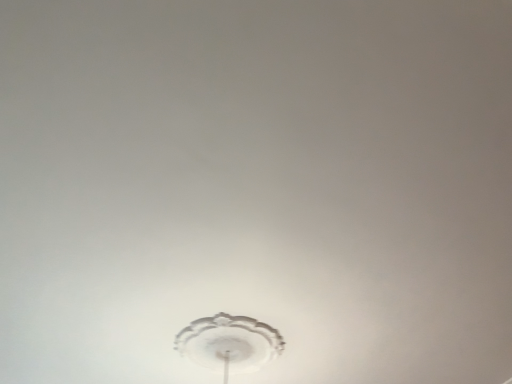
The height and width of the screenshot is (384, 512). What do you see at coordinates (229, 343) in the screenshot?
I see `white glossy ceiling medallion at center` at bounding box center [229, 343].

Find the location of `white glossy ceiling medallion at center`. white glossy ceiling medallion at center is located at coordinates (229, 343).

You are a GUI agent. You are given a task and a screenshot of the screen. Output one action in this format:
    pyautogui.click(x=<x>, y=<y>)
    Task: Click on the white glossy ceiling medallion at center
    The height and width of the screenshot is (384, 512).
    Given the screenshot: What is the action you would take?
    pyautogui.click(x=229, y=343)